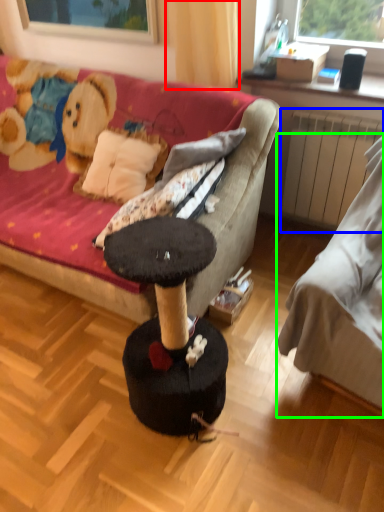
Question: Based on their relative distances, which object is nearer to curtain (highlighted by a red box)? Choose from radiator (highlighted by a blue box) and studio couch (highlighted by a green box).

Choices:
 (A) radiator
 (B) studio couch

Answer: (A)